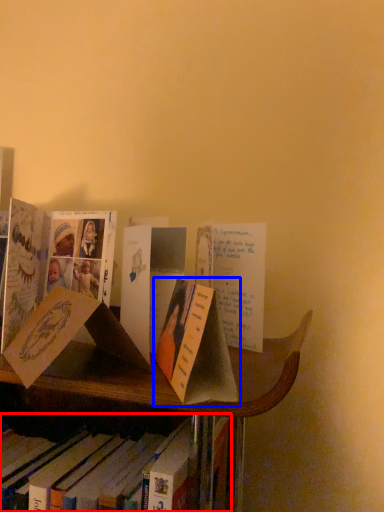
Question: Which object appears closest to the camera in this image, book (highlighted by a red box) or book (highlighted by a blue box)?

Choices:
 (A) book
 (B) book

Answer: (B)